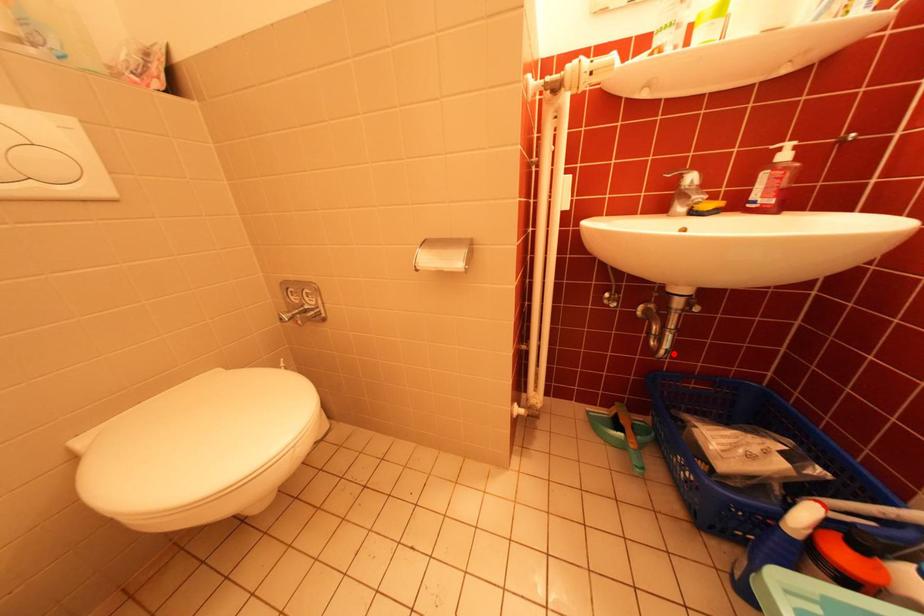
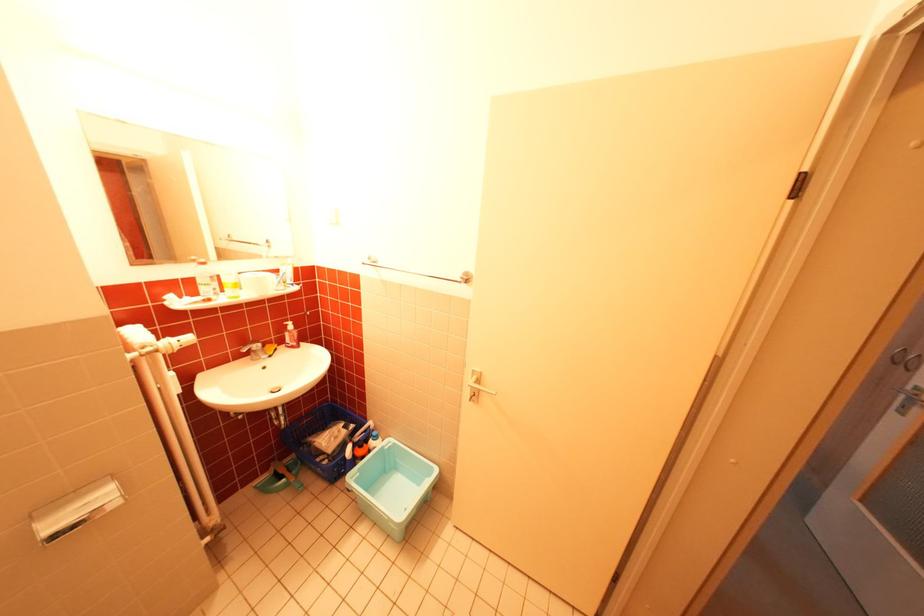
Question: I am providing you with two images of the same scene from different viewpoints. Image1 has a red point marked. In image2, the corresponding 3D location appears at what relative position? Reply with the corresponding letter.

Choices:
 (A) Closer
 (B) Farther

Answer: (A)